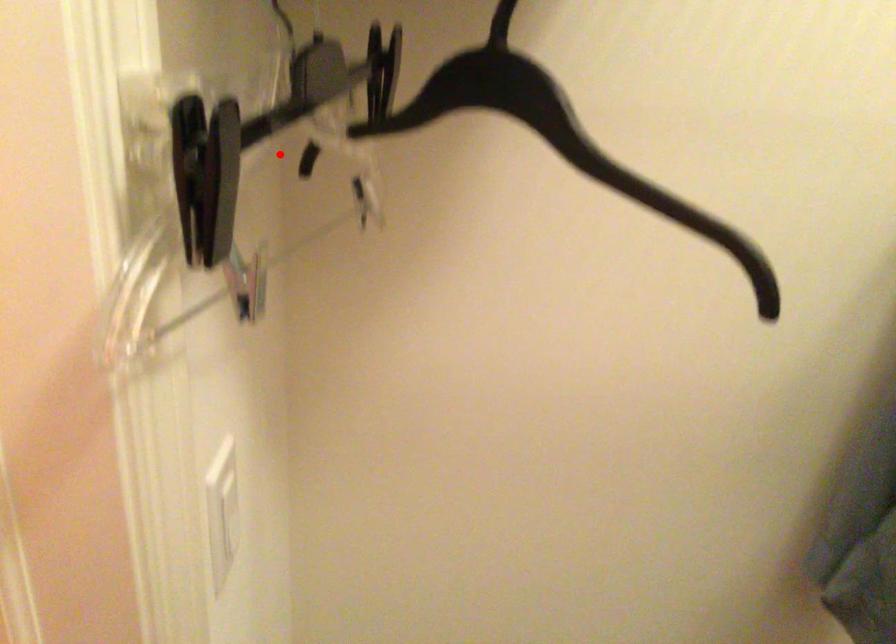
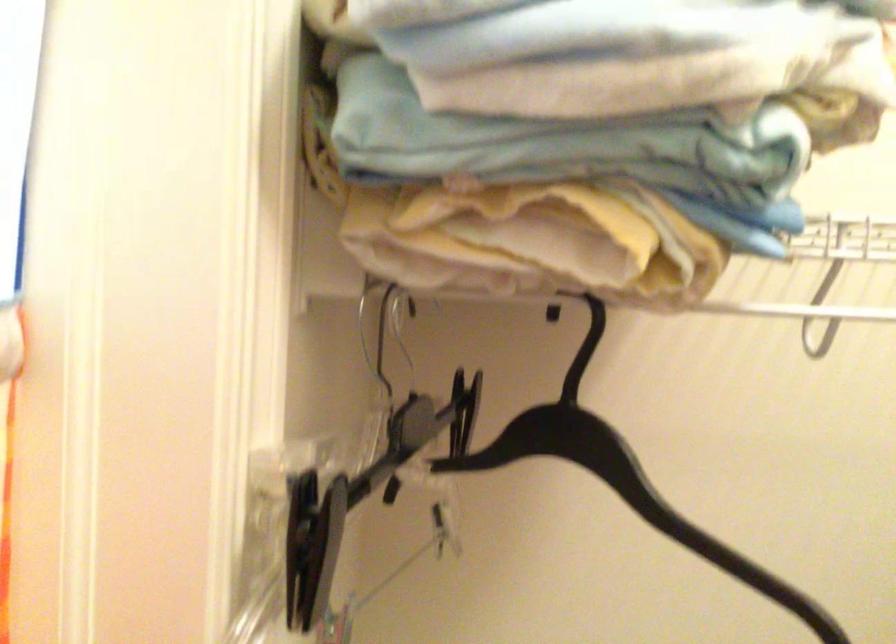
Locate, in the second image, the point that corresponds to the highlighted location in the first image.

(362, 488)